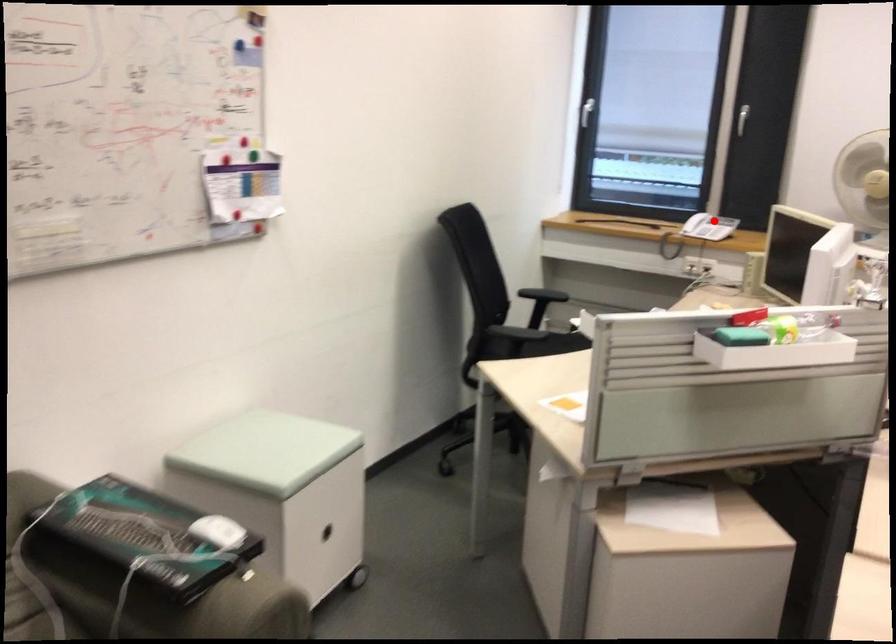
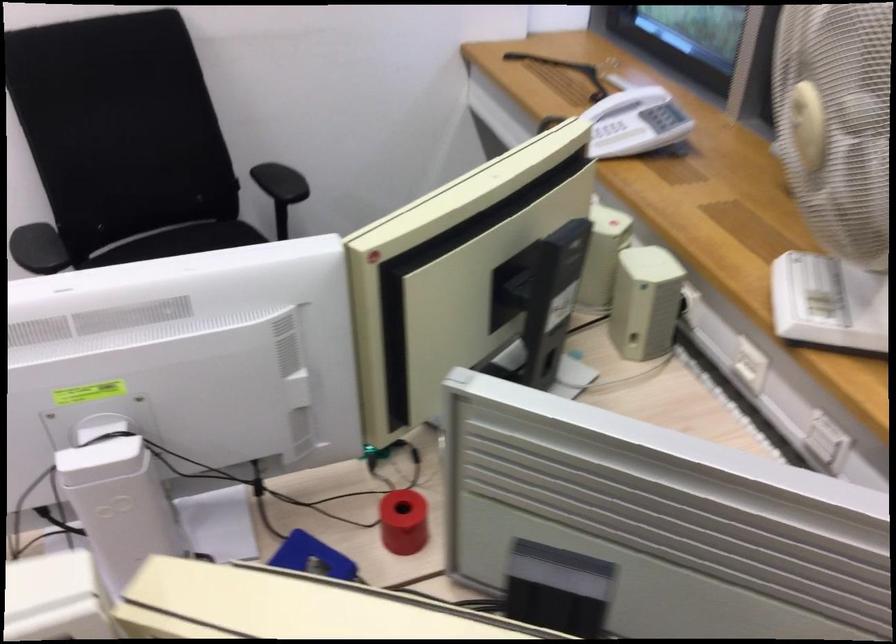
Question: I am providing you with two images of the same scene from different viewpoints. In image1, a red point is highlighted. Considering the same 3D point in image2, which of the following is correct?

Choices:
 (A) It is closer
 (B) It is farther

Answer: (A)